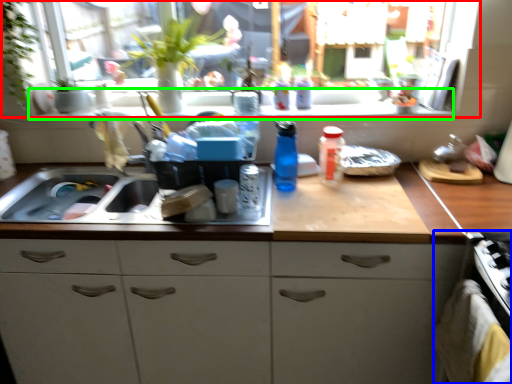
Question: Which object is positioned closest to window (highlighted by a red box)? Select from oven (highlighted by a blue box) and window sill (highlighted by a green box).

Choices:
 (A) oven
 (B) window sill

Answer: (B)